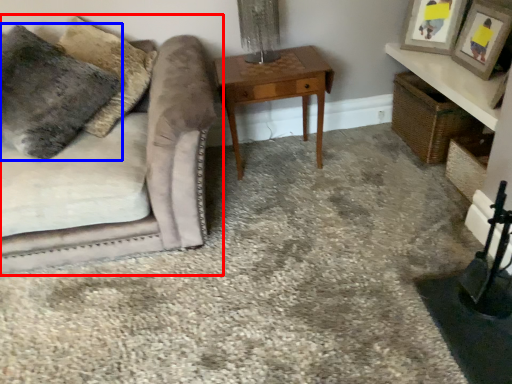
Question: Which object is closer to the camera taking this photo, studio couch (highlighted by a red box) or pillow (highlighted by a blue box)?

Choices:
 (A) studio couch
 (B) pillow

Answer: (A)